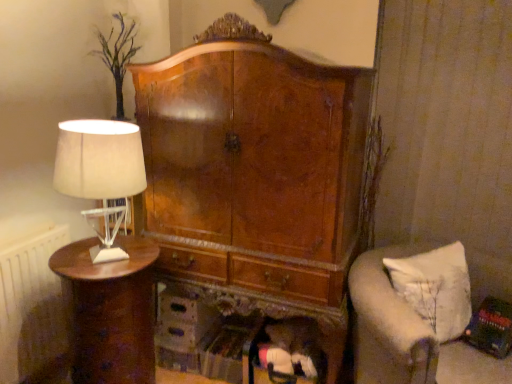
Question: Does white fabric cushion at lower right have a larger size compared to white radiator at left?

Choices:
 (A) yes
 (B) no

Answer: (A)

Question: From a real-world perspective, is white fabric cushion at lower right positioned under white radiator at left based on gravity?

Choices:
 (A) no
 (B) yes

Answer: (A)

Question: Is white fabric cushion at lower right positioned with its back to white radiator at left?

Choices:
 (A) no
 (B) yes

Answer: (A)

Question: Could you tell me if white fabric cushion at lower right is facing white radiator at left?

Choices:
 (A) yes
 (B) no

Answer: (B)

Question: Is white fabric cushion at lower right to the right of white radiator at left from the viewer's perspective?

Choices:
 (A) yes
 (B) no

Answer: (A)

Question: Do you think shiny brown wood nightstand at left is within white fabric cushion at lower right, or outside of it?

Choices:
 (A) inside
 (B) outside

Answer: (B)

Question: From a real-world perspective, is shiny brown wood nightstand at left above or below white fabric cushion at lower right?

Choices:
 (A) below
 (B) above

Answer: (A)

Question: From the image's perspective, is shiny brown wood nightstand at left located above or below white fabric cushion at lower right?

Choices:
 (A) above
 (B) below

Answer: (B)

Question: Relative to white fabric cushion at lower right, is shiny brown wood nightstand at left in front or behind?

Choices:
 (A) front
 (B) behind

Answer: (A)

Question: Is white radiator at left in front of or behind white fabric lampshade at left in the image?

Choices:
 (A) behind
 (B) front

Answer: (A)

Question: Is white radiator at left wider or thinner than white fabric lampshade at left?

Choices:
 (A) wide
 (B) thin

Answer: (B)

Question: From a real-world perspective, relative to white fabric lampshade at left, is white radiator at left vertically above or below?

Choices:
 (A) below
 (B) above

Answer: (A)

Question: Does point (39, 244) appear closer or farther from the camera than point (122, 213)?

Choices:
 (A) farther
 (B) closer

Answer: (B)

Question: Is shiny brown wood nightstand at left taller or shorter than white fabric lampshade at left?

Choices:
 (A) tall
 (B) short

Answer: (A)

Question: Is point (140, 276) positioned closer to the camera than point (60, 145)?

Choices:
 (A) closer
 (B) farther

Answer: (B)